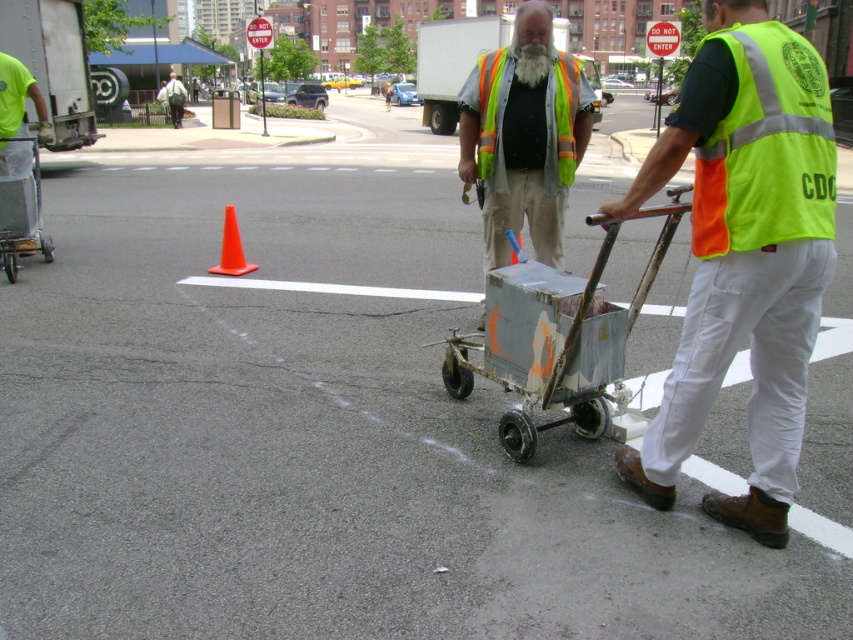
Question: Among these objects, which one is farthest from the camera?

Choices:
 (A) orange plastic traffic cone at center
 (B) high visibility fabric safety vest at center
 (C) reflective safety vest at center
 (D) neon yellow reflective vest at center-right

Answer: (A)

Question: Which point is closer to the camera?

Choices:
 (A) neon yellow reflective vest at center
 (B) reflective safety vest at center
 (C) high visibility fabric safety vest at center
 (D) neon yellow reflective vest at center-right

Answer: (D)

Question: Considering the real-world distances, which object is closest to the reflective safety vest at center?

Choices:
 (A) orange plastic traffic cone at center
 (B) neon yellow reflective vest at center
 (C) neon yellow reflective vest at center-right

Answer: (B)

Question: Does high visibility fabric safety vest at center have a greater width compared to metallic silver trolley at left?

Choices:
 (A) yes
 (B) no

Answer: (B)

Question: Considering the relative positions of rusty metal trolley at center and high visibility fabric safety vest at center in the image provided, where is rusty metal trolley at center located with respect to high visibility fabric safety vest at center?

Choices:
 (A) right
 (B) left

Answer: (A)

Question: Can you confirm if high visibility fabric safety vest at center is wider than metallic silver trolley at left?

Choices:
 (A) yes
 (B) no

Answer: (B)